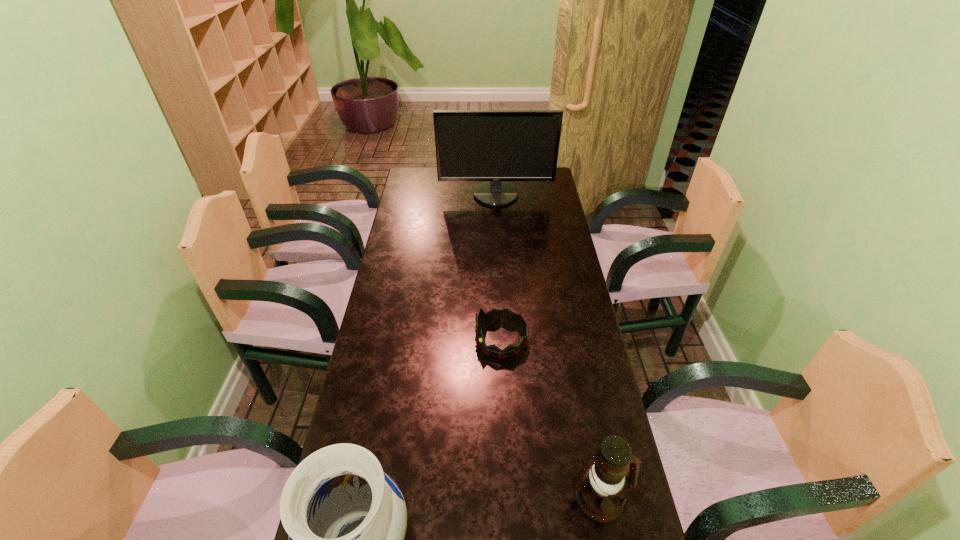
At what (x,y) coordinates should I click in order to perform the action: click on empty space that is in between the shortest object and the tallest object. Please return your answer as a coordinate pair (x, y). Looking at the image, I should click on (498, 267).

The image size is (960, 540). I want to click on empty location between the shortest object and the third tallest object, so click(x=550, y=418).

You are a GUI agent. You are given a task and a screenshot of the screen. Output one action in this format:
    pyautogui.click(x=<x>, y=<y>)
    Task: Click on the free spot between the tiara and the monitor
    The height and width of the screenshot is (540, 960).
    Given the screenshot: What is the action you would take?
    pyautogui.click(x=498, y=267)

You are a GUI agent. You are given a task and a screenshot of the screen. Output one action in this format:
    pyautogui.click(x=<x>, y=<y>)
    Task: Click on the free spot between the tallest object and the lantern
    
    Given the screenshot: What is the action you would take?
    pyautogui.click(x=547, y=346)

Locate which object ranks second in proximity to the second tallest object. Please provide its 2D coordinates. Your answer should be formatted as a tuple, i.e. [(x, y)], where the tuple contains the x and y coordinates of a point satisfying the conditions above.

[(494, 315)]

Locate which object ranks third in proximity to the shortest object. Please provide its 2D coordinates. Your answer should be formatted as a tuple, i.e. [(x, y)], where the tuple contains the x and y coordinates of a point satisfying the conditions above.

[(471, 145)]

Identify the location of vacant area in the image that satisfies the following two spatial constraints: 1. on the screen side of the farthest object; 2. at the front of the shortest object with jewels. The width and height of the screenshot is (960, 540). (503, 339).

You are a GUI agent. You are given a task and a screenshot of the screen. Output one action in this format:
    pyautogui.click(x=<x>, y=<y>)
    Task: Click on the vacant space that satisfies the following two spatial constraints: 1. on the screen side of the monitor; 2. at the front of the tiara with jewels
    
    Given the screenshot: What is the action you would take?
    pyautogui.click(x=503, y=339)

Find the location of `free region that satisfies the following two spatial constraints: 1. on the screen side of the farthest object; 2. at the front of the second farthest object with jewels`. free region that satisfies the following two spatial constraints: 1. on the screen side of the farthest object; 2. at the front of the second farthest object with jewels is located at coordinates (503, 339).

This screenshot has width=960, height=540. I want to click on vacant space that satisfies the following two spatial constraints: 1. on the screen side of the monitor; 2. at the front of the shortest object with jewels, so click(503, 339).